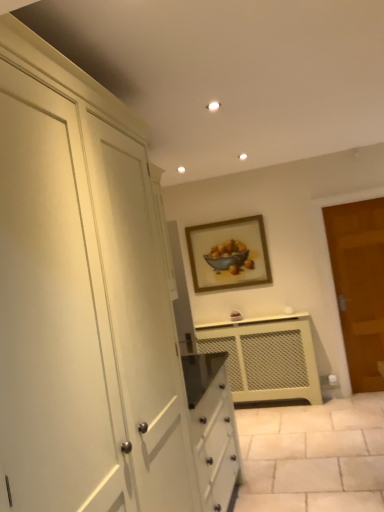
Question: Considering the relative sizes of wooden-framed painting at center and matte cream radiator at center in the image provided, is wooden-framed painting at center thinner than matte cream radiator at center?

Choices:
 (A) no
 (B) yes

Answer: (B)

Question: Is wooden-framed painting at center shorter than matte cream radiator at center?

Choices:
 (A) no
 (B) yes

Answer: (B)

Question: Is wooden-framed painting at center facing towards matte cream radiator at center?

Choices:
 (A) yes
 (B) no

Answer: (B)

Question: From a real-world perspective, is wooden-framed painting at center positioned under matte cream radiator at center based on gravity?

Choices:
 (A) no
 (B) yes

Answer: (A)

Question: From a real-world perspective, does wooden-framed painting at center stand above matte cream radiator at center?

Choices:
 (A) yes
 (B) no

Answer: (A)

Question: From a real-world perspective, relative to matte cream radiator at center, is wooden-framed painting at center vertically above or below?

Choices:
 (A) above
 (B) below

Answer: (A)

Question: In the image, is wooden-framed painting at center on the left side or the right side of matte cream radiator at center?

Choices:
 (A) right
 (B) left

Answer: (B)

Question: Relative to matte cream radiator at center, is wooden-framed painting at center in front or behind?

Choices:
 (A) front
 (B) behind

Answer: (B)

Question: In terms of size, does wooden-framed painting at center appear bigger or smaller than matte cream radiator at center?

Choices:
 (A) small
 (B) big

Answer: (A)

Question: From a real-world perspective, is brown wooden door at right physically located above or below matte cream radiator at center?

Choices:
 (A) above
 (B) below

Answer: (A)

Question: Does point (352, 376) appear closer or farther from the camera than point (249, 375)?

Choices:
 (A) farther
 (B) closer

Answer: (B)

Question: Is brown wooden door at right wider or thinner than matte cream radiator at center?

Choices:
 (A) wide
 (B) thin

Answer: (B)

Question: Do you think brown wooden door at right is within matte cream radiator at center, or outside of it?

Choices:
 (A) inside
 (B) outside

Answer: (B)

Question: From a real-world perspective, is matte cream radiator at center above or below brown wooden door at right?

Choices:
 (A) above
 (B) below

Answer: (B)

Question: From the image's perspective, relative to brown wooden door at right, is matte cream radiator at center above or below?

Choices:
 (A) below
 (B) above

Answer: (A)